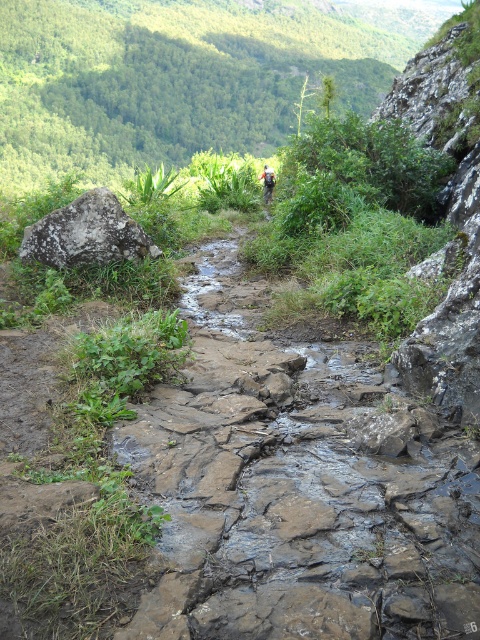
You are a hiker carrying a camouflage fabric backpack at center and need to cross the wet stone trail at center. Can you safely walk through the trail without your backpack getting wet?

The wet stone trail at center might be wider than camouflage fabric backpack at center, so there is a possibility that the backpack will not get wet if the trail is wide enough to accommodate the backpack without touching the wet areas. However, since the exact width isn not specified, caution is advised.

You are a hiker trying to locate the wet stone trail at center. According to the map coordinates, where should you look?

The wet stone trail at center is located at point (298,488).

From the picture: You are a hiker planning to cross the wet stone trail at center and the gray rough rock at left. Which object should you avoid stepping on if you want to prevent slipping?

You should avoid stepping on the wet stone trail at center because it is bigger and more slippery than the gray rough rock at left.